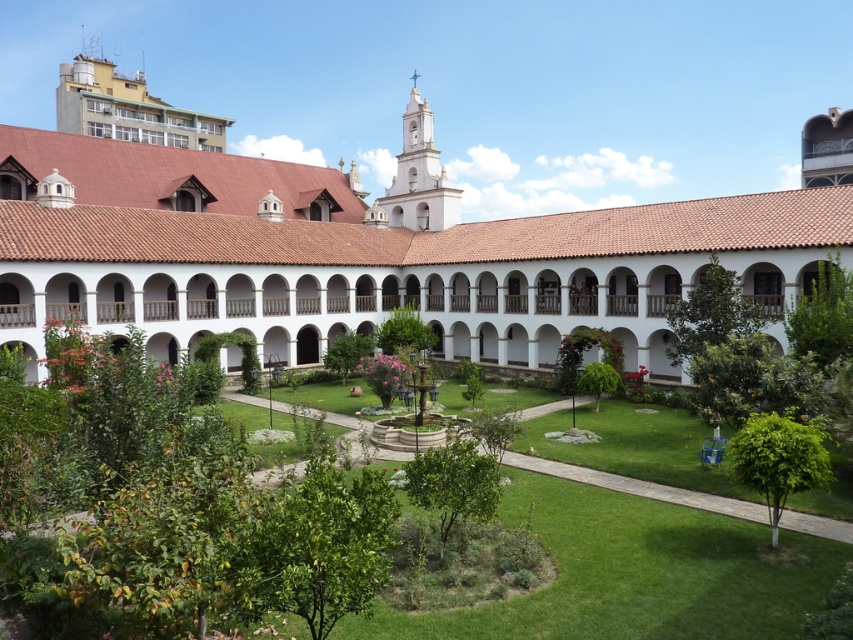
You are a gardener planning to plant new flowers in the courtyard. You see the white stucco building at center and the green grass at center. Which surface can you plant flowers on?

The green grass at center is the surface where flowers can be planted, as the white stucco building at center is positioned over it and likely made of nonplantable material.

You are a visitor standing in the courtyard looking at the white stucco building at center and the green grass at center. Which object is taller?

The white stucco building at center is taller than the green grass at center.

You are standing in the courtyard and want to take a photo of the white stucco building at center with the green grass at center in the foreground. Is this possible given their positions?

The green grass at center is behind the white stucco building at center, so you cannot have the green grass at center in the foreground while photographing the white stucco building at center.